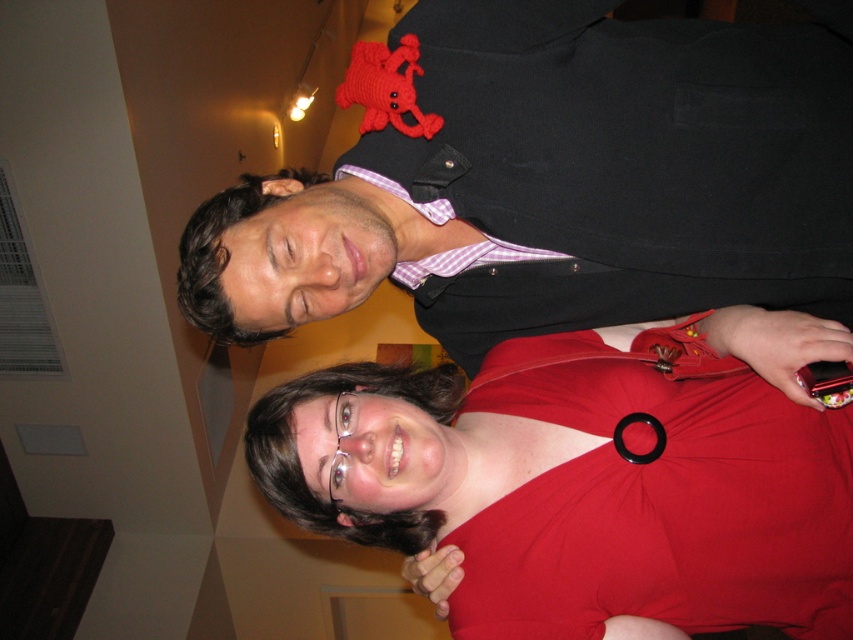
Question: Considering the relative positions of matte black vest at upper center and red matte dress at lower center in the image provided, where is matte black vest at upper center located with respect to red matte dress at lower center?

Choices:
 (A) right
 (B) left

Answer: (B)

Question: Which of the following is the farthest from the observer?

Choices:
 (A) matte black vest at upper center
 (B) red matte dress at lower center

Answer: (B)

Question: Which point is farther from the camera taking this photo?

Choices:
 (A) (737, 60)
 (B) (543, 625)

Answer: (A)

Question: Is matte black vest at upper center bigger than red matte dress at lower center?

Choices:
 (A) no
 (B) yes

Answer: (B)

Question: Does matte black vest at upper center have a lesser width compared to red matte dress at lower center?

Choices:
 (A) yes
 (B) no

Answer: (B)